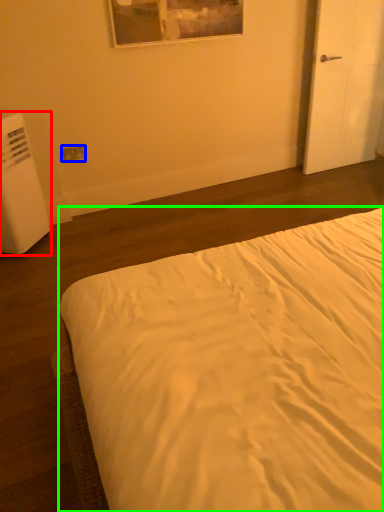
Question: Estimate the real-world distances between objects in this image. Which object is farther from water heater (highlighted by a red box), electric outlet (highlighted by a blue box) or bed (highlighted by a green box)?

Choices:
 (A) electric outlet
 (B) bed

Answer: (B)